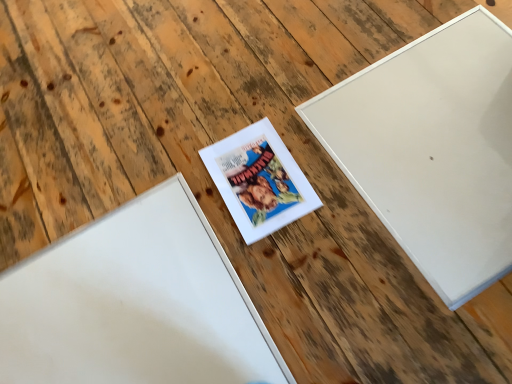
Find the location of a particular element. vacant location behind white matte picture frame at center, the 3th picture frame in the right-to-left sequence is located at coordinates (112, 144).